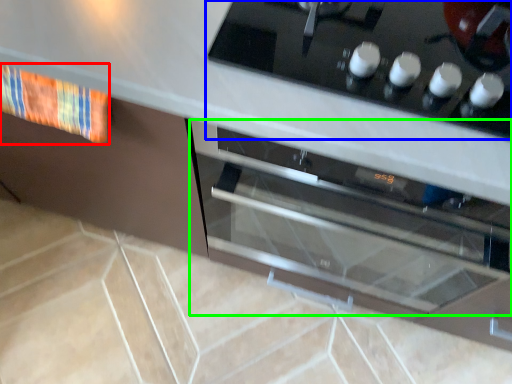
Question: Which object is the farthest from material (highlighted by a red box)? Choose among these: home appliance (highlighted by a blue box) or oven (highlighted by a green box).

Choices:
 (A) home appliance
 (B) oven

Answer: (B)